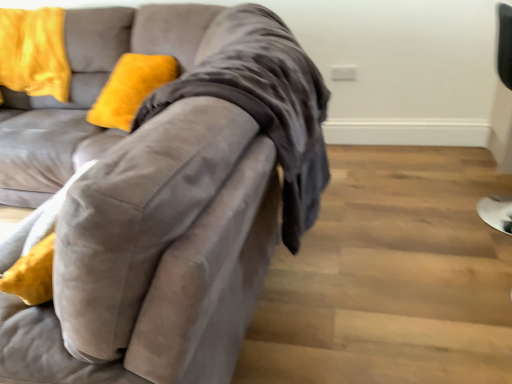
Question: Looking at their shapes, would you say velvet gray couch at left is wider or thinner than black leather chair at right?

Choices:
 (A) wide
 (B) thin

Answer: (A)

Question: Looking at the image, does velvet gray couch at left seem bigger or smaller compared to black leather chair at right?

Choices:
 (A) small
 (B) big

Answer: (B)

Question: Which object is positioned farthest from the velvet gray couch at left?

Choices:
 (A) velvet yellow pillow at upper left
 (B) black leather chair at right

Answer: (B)

Question: Which is nearer to the black leather chair at right?

Choices:
 (A) velvet gray couch at left
 (B) velvet yellow pillow at upper left

Answer: (A)